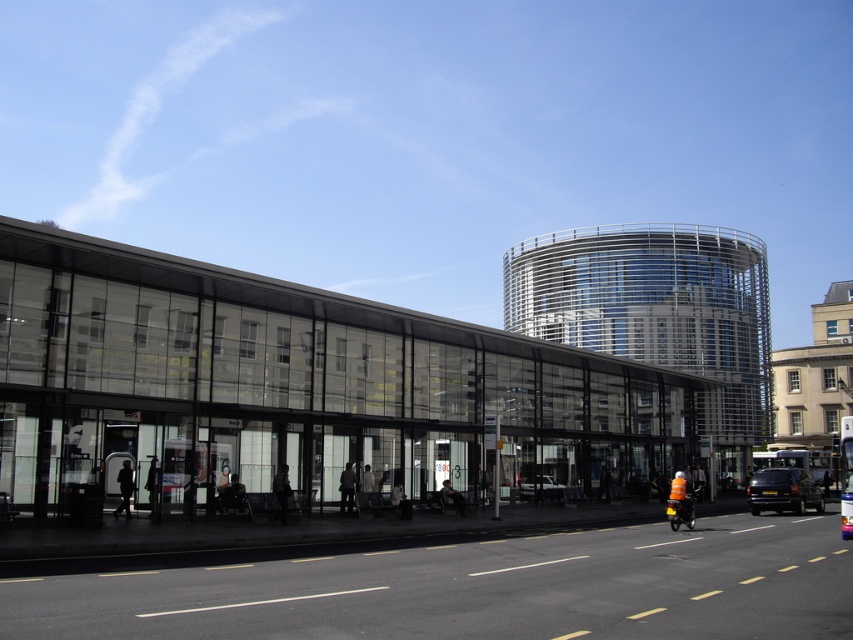
Is transparent glass bus station at center to the left of white glossy car at center from the viewer's perspective?

Indeed, transparent glass bus station at center is positioned on the left side of white glossy car at center.

Can you confirm if transparent glass bus station at center is thinner than white glossy car at center?

In fact, transparent glass bus station at center might be wider than white glossy car at center.

Which is behind, point (387, 369) or point (529, 492)?

Point (529, 492)

Locate an element on the screen. transparent glass bus station at center is located at coordinates (x=294, y=387).

Does transparent glass bus station at center have a greater height compared to dark gray metallic car at center-right?

Indeed, transparent glass bus station at center has a greater height compared to dark gray metallic car at center-right.

Does transparent glass bus station at center appear on the right side of dark gray metallic car at center-right?

In fact, transparent glass bus station at center is to the left of dark gray metallic car at center-right.

Describe the element at coordinates (294, 387) in the screenshot. I see `transparent glass bus station at center` at that location.

Find the location of a particular element. The width and height of the screenshot is (853, 640). transparent glass bus station at center is located at coordinates (294, 387).

Can you confirm if dark gray metallic car at center-right is shorter than blue metallic bus at center?

Correct, dark gray metallic car at center-right is not as tall as blue metallic bus at center.

Does point (764, 497) come behind point (840, 509)?

Yes, it is behind point (840, 509).

Which is in front, point (782, 468) or point (846, 480)?

Positioned in front is point (846, 480).

Identify the location of dark gray metallic car at center-right. The height and width of the screenshot is (640, 853). (782, 490).